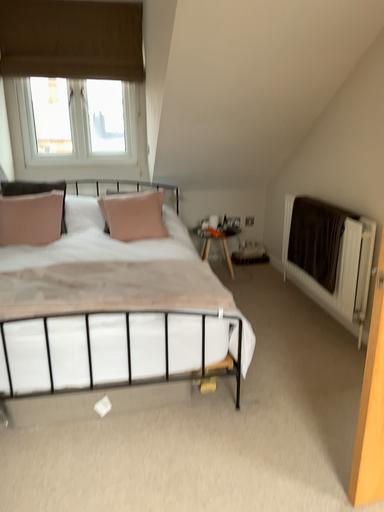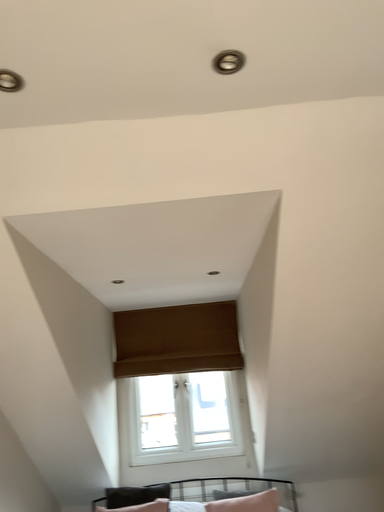
Question: How did the camera likely rotate when shooting the video?

Choices:
 (A) rotated left
 (B) rotated right

Answer: (A)